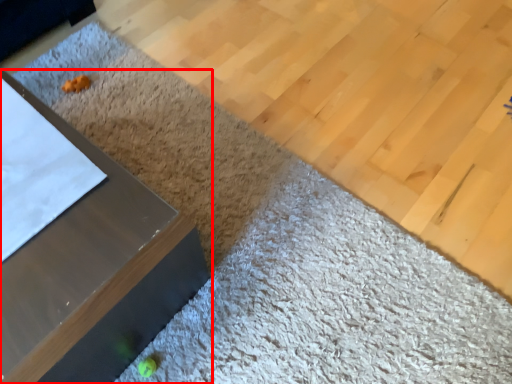
Question: From the image's perspective, considering the relative positions of furniture (annotated by the red box) and plywood in the image provided, where is furniture (annotated by the red box) located with respect to the staircase?

Choices:
 (A) below
 (B) above

Answer: (A)